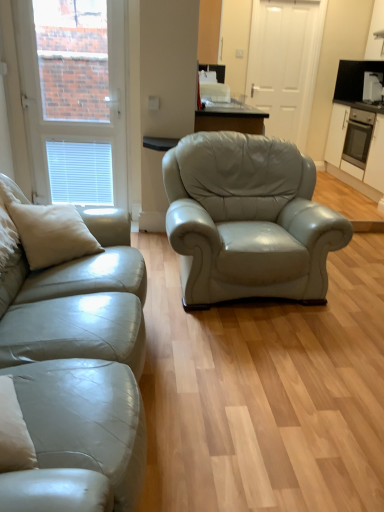
Question: In the image, is beige leather pillow at left positioned in front of or behind white matte window at upper left?

Choices:
 (A) behind
 (B) front

Answer: (B)

Question: Considering the positions of point (9, 194) and point (54, 187), is point (9, 194) closer or farther from the camera than point (54, 187)?

Choices:
 (A) farther
 (B) closer

Answer: (B)

Question: Based on their relative distances, which object is nearer to the white matte door at center?

Choices:
 (A) white glossy toaster at upper right
 (B) white matte cabinet at right
 (C) white matte window at upper left
 (D) satin beige leather couch at left
 (E) beige leather pillow at left

Answer: (B)

Question: Which object is positioned farthest from the white matte door at center?

Choices:
 (A) white matte cabinet at right
 (B) white matte window at upper left
 (C) satin beige leather couch at left
 (D) white glossy toaster at upper right
 (E) beige leather pillow at left

Answer: (C)